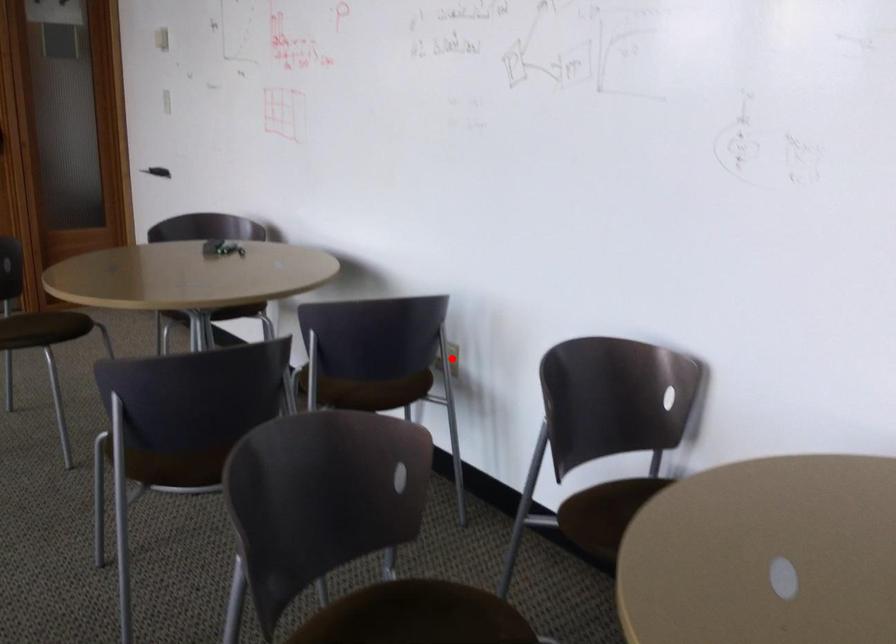
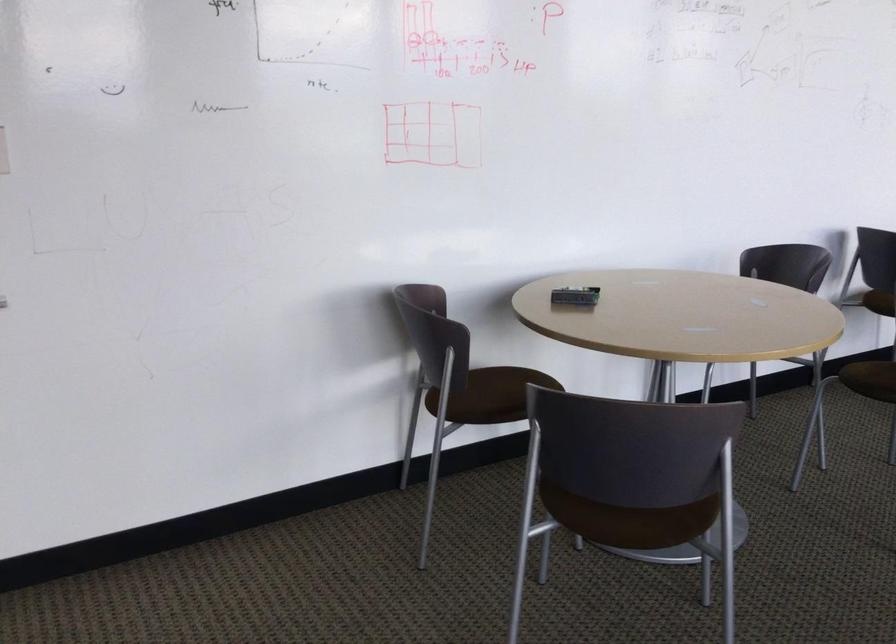
Question: I am providing you with two images of the same scene from different viewpoints. A red point is marked on the first image. Is the red point's position out of view in image 2?

Choices:
 (A) Yes
 (B) No

Answer: (A)